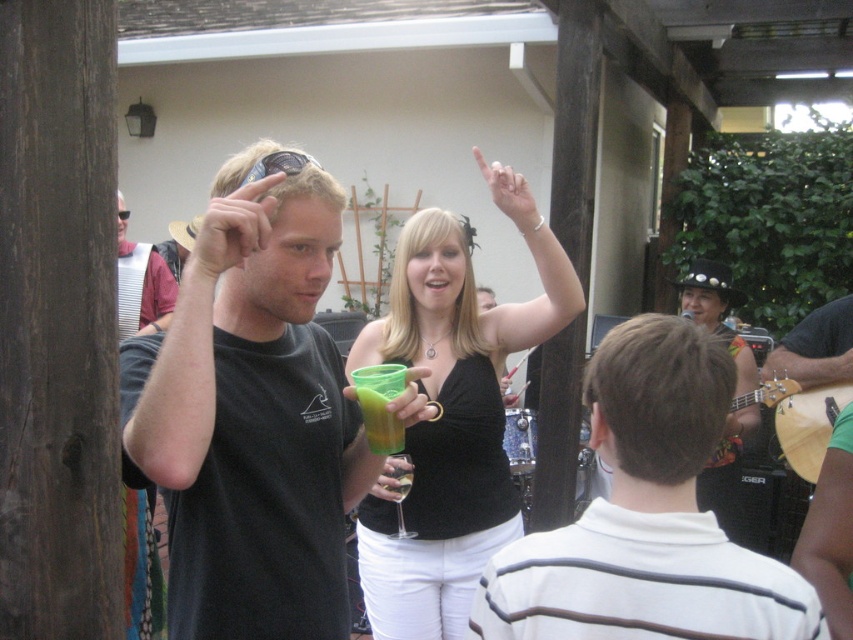
Can you confirm if black matte t-shirt at center is wider than matte black shirt at left?

Incorrect, black matte t-shirt at center's width does not surpass matte black shirt at left's.

Between point (137, 412) and point (161, 310), which one is positioned behind?

Positioned behind is point (161, 310).

Is point (280, 228) farther from camera compared to point (131, 321)?

That is False.

The image size is (853, 640). Identify the location of black matte t-shirt at center. (251, 416).

Who is positioned more to the left, white striped shirt at center or matte black tank top at center?

Positioned to the left is matte black tank top at center.

Is point (749, 589) less distant than point (396, 630)?

That is True.

What do you see at coordinates (646, 516) in the screenshot? I see `white striped shirt at center` at bounding box center [646, 516].

Locate an element on the screen. The width and height of the screenshot is (853, 640). white striped shirt at center is located at coordinates (646, 516).

Can you confirm if white striped shirt at center is positioned below green translucent cup at center?

Indeed, white striped shirt at center is positioned under green translucent cup at center.

How much distance is there between white striped shirt at center and green translucent cup at center?

A distance of 42.16 centimeters exists between white striped shirt at center and green translucent cup at center.

Between point (674, 540) and point (361, 394), which one is positioned behind?

The point (361, 394) is behind.

The image size is (853, 640). I want to click on white striped shirt at center, so click(x=646, y=516).